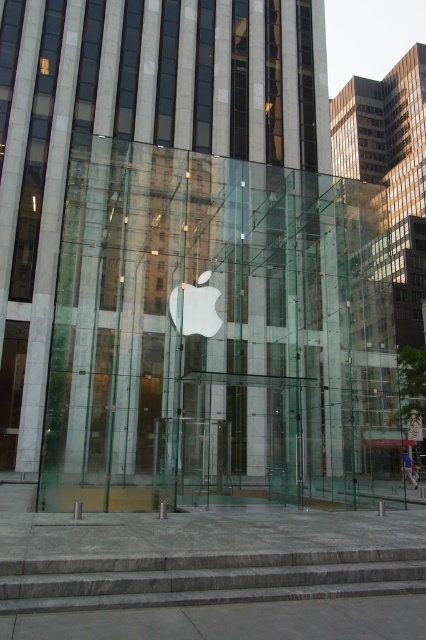
Does transparent glass apple store at center have a lesser width compared to gray stone stairs at lower center?

Incorrect, transparent glass apple store at center's width is not less than gray stone stairs at lower center's.

Does transparent glass apple store at center have a lesser height compared to gray stone stairs at lower center?

Incorrect, transparent glass apple store at center's height does not fall short of gray stone stairs at lower center's.

What do you see at coordinates (215, 337) in the screenshot?
I see `transparent glass apple store at center` at bounding box center [215, 337].

In order to click on transparent glass apple store at center in this screenshot , I will do `click(215, 337)`.